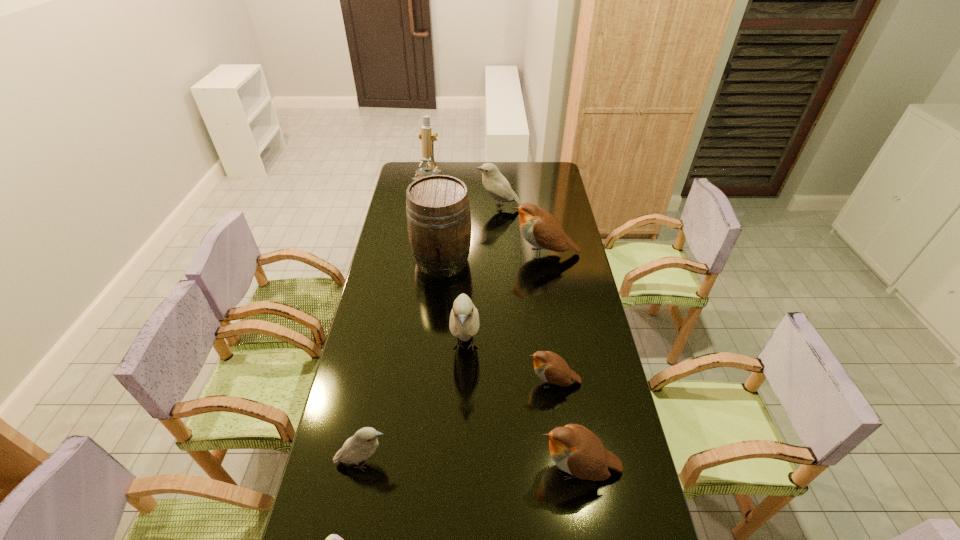
Where is `free space located 0.150m at the beak of the farthest bird`? The width and height of the screenshot is (960, 540). free space located 0.150m at the beak of the farthest bird is located at coordinates (445, 207).

Image resolution: width=960 pixels, height=540 pixels. Find the location of `free spot located at the beak of the farthest bird`. free spot located at the beak of the farthest bird is located at coordinates (396, 207).

Locate an element on the screen. The height and width of the screenshot is (540, 960). vacant region located at the face of the nearest brown bird is located at coordinates (414, 469).

Find the location of `vacant position located 0.190m at the face of the nearest brown bird`. vacant position located 0.190m at the face of the nearest brown bird is located at coordinates (468, 469).

Identify the location of blank area located 0.180m at the face of the nearest brown bird. The height and width of the screenshot is (540, 960). (471, 469).

This screenshot has width=960, height=540. Identify the location of free space located 0.050m at the beak of the smallest white bird. (410, 463).

The height and width of the screenshot is (540, 960). I want to click on vacant space situated 0.310m at the face of the second nearest brown bird, so click(430, 382).

You are a GUI agent. You are given a task and a screenshot of the screen. Output one action in this format:
    pyautogui.click(x=<x>, y=<y>)
    Task: Click on the vacant space located 0.240m at the face of the second nearest brown bird
    
    Given the screenshot: What is the action you would take?
    pyautogui.click(x=452, y=382)

Image resolution: width=960 pixels, height=540 pixels. I want to click on free space located 0.280m at the face of the second nearest brown bird, so click(x=440, y=382).

Identify the location of microscope at the left edge. (425, 134).